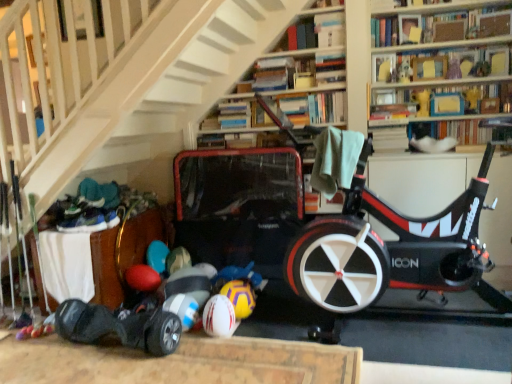
Question: Is hardcover book at upper center, the sixth book when ordered from bottom to top, facing towards matte cardboard book at upper right, which is the 4th book from bottom to top?

Choices:
 (A) no
 (B) yes

Answer: (A)

Question: Is hardcover book at upper center, the sixth book when ordered from bottom to top, thinner than matte cardboard book at upper right, marked as the third book in a top-to-bottom arrangement?

Choices:
 (A) no
 (B) yes

Answer: (A)

Question: Is hardcover book at upper center, the sixth book when ordered from bottom to top, not within matte cardboard book at upper right, marked as the third book in a top-to-bottom arrangement?

Choices:
 (A) yes
 (B) no

Answer: (A)

Question: Can you confirm if hardcover book at upper center, the sixth book when ordered from bottom to top, is taller than matte cardboard book at upper right, marked as the third book in a top-to-bottom arrangement?

Choices:
 (A) yes
 (B) no

Answer: (B)

Question: Can you confirm if hardcover book at upper center, the 1th book when ordered from top to bottom, is positioned to the left of matte cardboard book at upper right, marked as the third book in a top-to-bottom arrangement?

Choices:
 (A) no
 (B) yes

Answer: (A)

Question: Is hardcover book at upper center, the sixth book when ordered from bottom to top, placed right next to matte cardboard book at upper right, marked as the third book in a top-to-bottom arrangement?

Choices:
 (A) no
 (B) yes

Answer: (A)

Question: Is wooden chest at lower left not near blue cardboard book at upper right, the third book positioned from the bottom?

Choices:
 (A) yes
 (B) no

Answer: (A)

Question: Considering the relative sizes of wooden chest at lower left and blue cardboard book at upper right, the third book positioned from the bottom, in the image provided, is wooden chest at lower left thinner than blue cardboard book at upper right, the third book positioned from the bottom,?

Choices:
 (A) no
 (B) yes

Answer: (A)

Question: Is wooden chest at lower left to the left of blue cardboard book at upper right, the third book positioned from the bottom, from the viewer's perspective?

Choices:
 (A) yes
 (B) no

Answer: (A)

Question: Is wooden chest at lower left to the right of blue cardboard book at upper right, which appears as the 4th book when viewed from the top, from the viewer's perspective?

Choices:
 (A) yes
 (B) no

Answer: (B)

Question: Is blue cardboard book at upper right, the third book positioned from the bottom, completely or partially inside wooden chest at lower left?

Choices:
 (A) no
 (B) yes

Answer: (A)

Question: Is wooden chest at lower left not inside blue cardboard book at upper right, the third book positioned from the bottom?

Choices:
 (A) yes
 (B) no

Answer: (A)

Question: Is yellowtexturebeach ball at lower center in contact with blue cardboard book at upper right, which appears as the 4th book when viewed from the top?

Choices:
 (A) yes
 (B) no

Answer: (B)